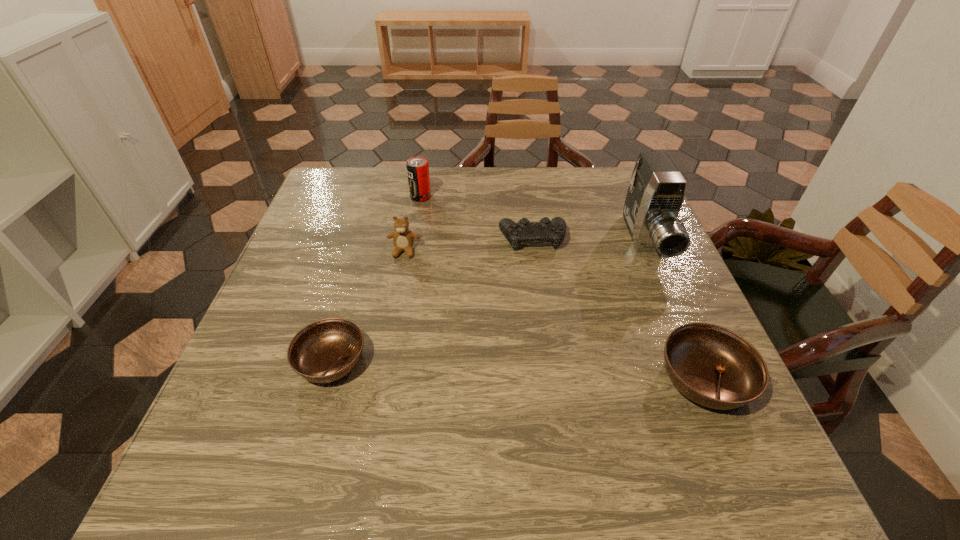
Image resolution: width=960 pixels, height=540 pixels. Find the location of `free space located 0.050m on the front of the second tallest object`. free space located 0.050m on the front of the second tallest object is located at coordinates (418, 213).

Find the location of a particular element. This screenshot has height=540, width=960. free location located 0.280m at the front of the camcorder, highlighting the lens is located at coordinates (702, 374).

At what (x,y) coordinates should I click in order to perform the action: click on vacant position located 0.280m on the left of the control. Please return your answer as a coordinate pair (x, y). The height and width of the screenshot is (540, 960). Looking at the image, I should click on (391, 238).

Find the location of a particular element. This screenshot has width=960, height=540. free space located on the front-facing side of the teddy bear is located at coordinates (383, 361).

This screenshot has height=540, width=960. I want to click on object located at the far edge, so click(x=417, y=167).

The image size is (960, 540). I want to click on object located at the left edge, so click(324, 351).

The image size is (960, 540). Find the location of `soup bowl located in the right edge section of the desktop`. soup bowl located in the right edge section of the desktop is located at coordinates (715, 367).

Where is `camcorder at the right edge`? camcorder at the right edge is located at coordinates (656, 191).

Image resolution: width=960 pixels, height=540 pixels. What are the coordinates of `object that is at the near left corner` in the screenshot? It's located at (324, 351).

Find the location of a particular element. This screenshot has width=960, height=540. object at the near right corner is located at coordinates (715, 367).